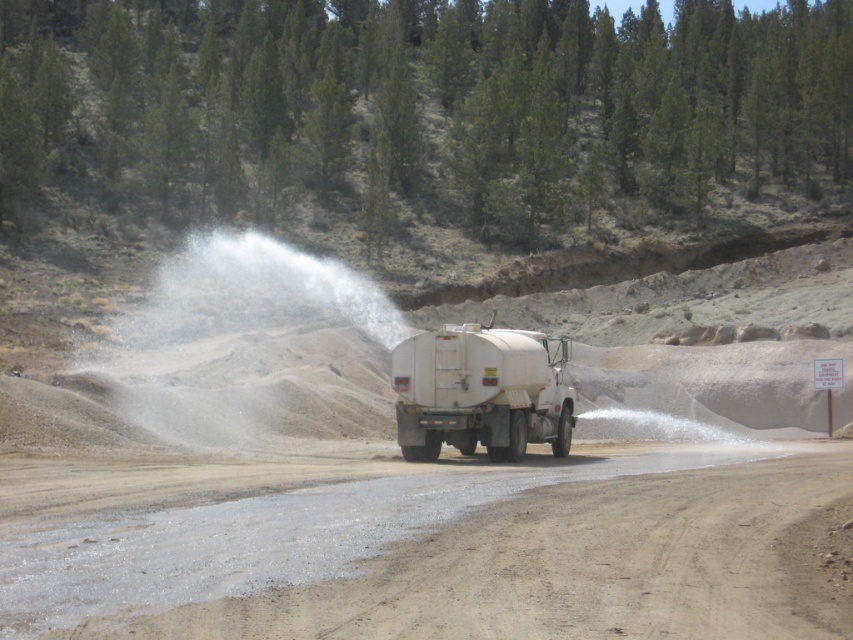
You are standing at the camera position observing the construction site. There are two points marked on the ground, one at point (692, 564) and the other at point (561, 428). Which of these points is nearer to your current position?

Point (692, 564) is closer to the camera than point (561, 428), so the point at (692, 564) is nearer to your current position.

You are a drone operator trying to capture aerial footage of the dull brown dirt track at center. To do this, you need to position your drone above the track. Given the coordinates provided, what is the exact 2D point you should aim for?

The exact 2D point to aim for is at coordinates (x=415, y=547), as that is where the dull brown dirt track at center is located.